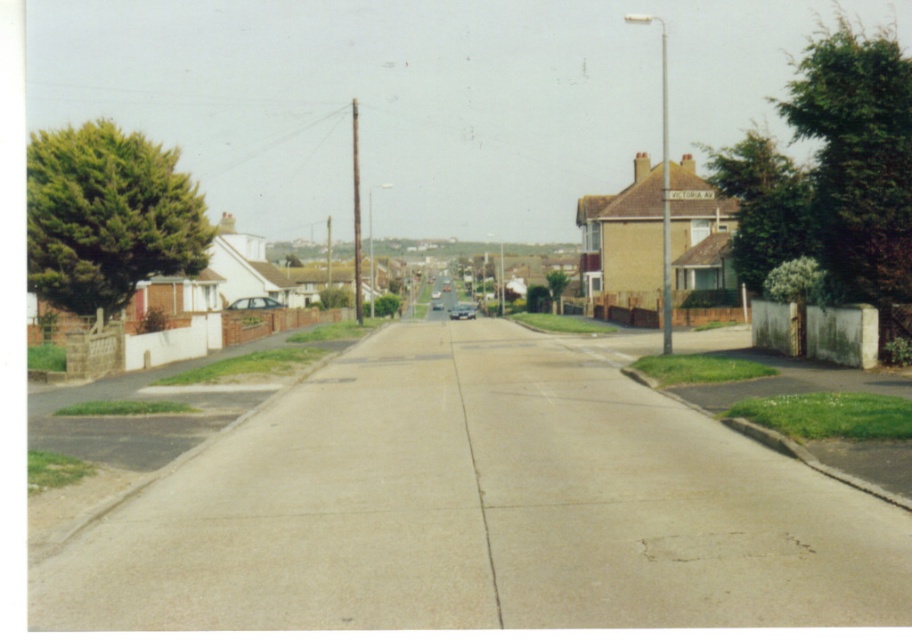
Question: Is matte silver car at center below shiny silver car at center?

Choices:
 (A) no
 (B) yes

Answer: (A)

Question: Does matte silver car at center appear on the right side of shiny silver car at center?

Choices:
 (A) no
 (B) yes

Answer: (A)

Question: Among these objects, which one is nearest to the camera?

Choices:
 (A) shiny silver car at center
 (B) matte silver car at center

Answer: (B)

Question: Which point is closer to the camera taking this photo?

Choices:
 (A) (272, 300)
 (B) (449, 316)

Answer: (A)

Question: Is matte silver car at center positioned in front of shiny silver car at center?

Choices:
 (A) no
 (B) yes

Answer: (B)